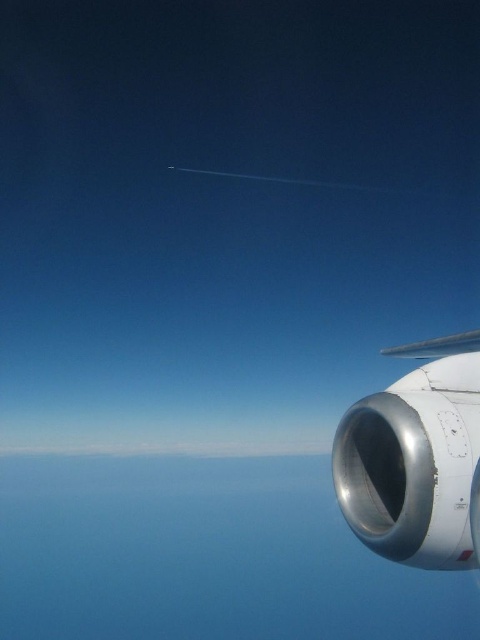
Does metallic jet engine at right come behind silver metallic wing at upper right?

No, it is not.

Who is taller, metallic jet engine at right or silver metallic wing at upper right?

Standing taller between the two is metallic jet engine at right.

Where is `metallic jet engine at right`? Image resolution: width=480 pixels, height=640 pixels. metallic jet engine at right is located at coordinates (417, 460).